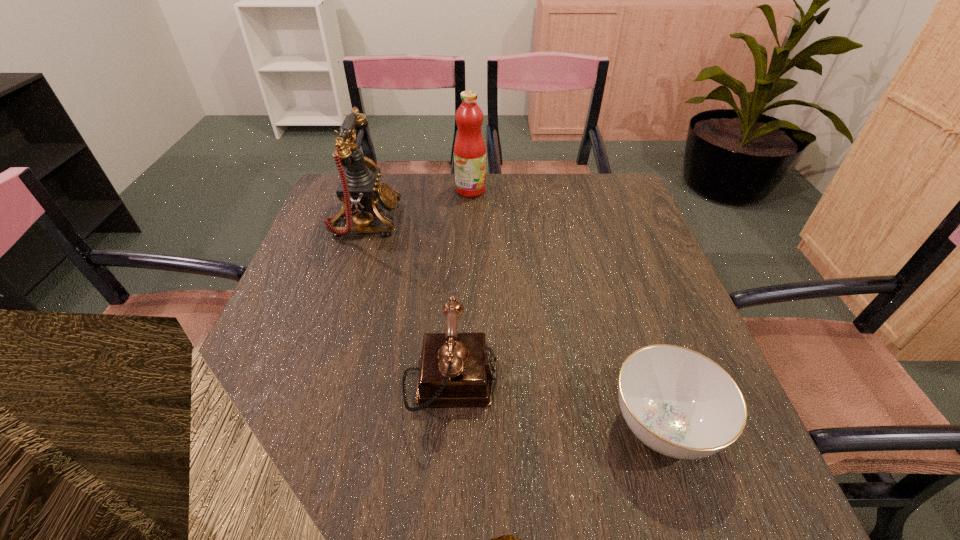
The image size is (960, 540). Find the location of `fruit juice`. fruit juice is located at coordinates (469, 149).

Locate an element on the screen. the farther telephone is located at coordinates (360, 192).

Where is `the left telephone`? This screenshot has height=540, width=960. the left telephone is located at coordinates tap(360, 192).

At what (x,y) coordinates should I click in order to perform the action: click on the nearer telephone. Please return your answer as a coordinate pair (x, y). The height and width of the screenshot is (540, 960). Looking at the image, I should click on (456, 369).

This screenshot has width=960, height=540. I want to click on the second shortest object, so click(456, 369).

This screenshot has width=960, height=540. I want to click on chinaware, so click(678, 402).

Where is `the shortest object`? The image size is (960, 540). the shortest object is located at coordinates (678, 402).

The height and width of the screenshot is (540, 960). What are the coordinates of `blank space located on the front label of the fruit juice` in the screenshot? It's located at [561, 190].

Locate an element on the screen. The height and width of the screenshot is (540, 960). free space located on the front of the left telephone, featuring the rotary dial is located at coordinates (448, 220).

Find the location of a particular element. Image resolution: width=960 pixels, height=540 pixels. vacant region located 0.180m on the dial of the nearer telephone is located at coordinates (590, 382).